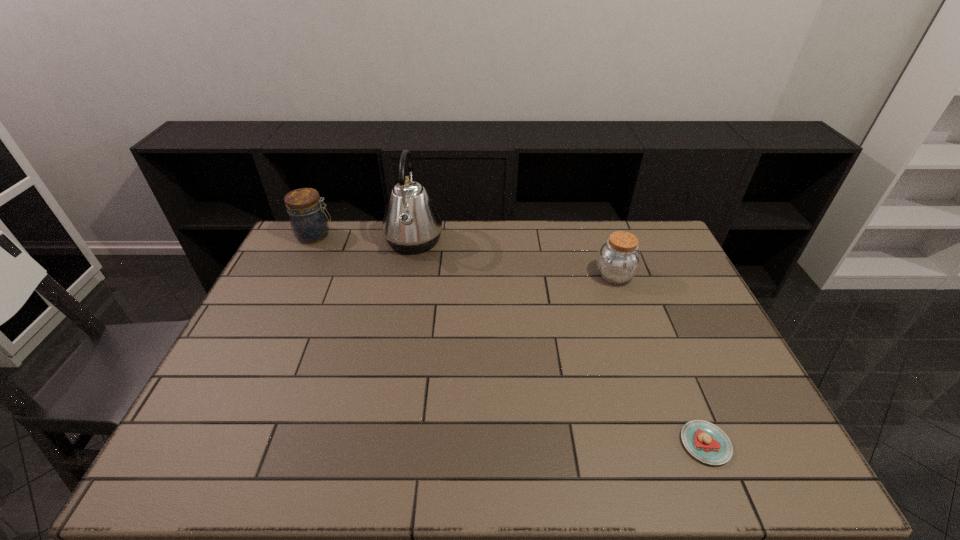
Locate an element on the screen. vacant point that satisfies the following two spatial constraints: 1. from the spout of the nearer jar; 2. on the right side of the second object from left to right is located at coordinates (407, 275).

The image size is (960, 540). Find the location of `free spot that satisfies the following two spatial constraints: 1. from the spout of the kettle; 2. on the right side of the right jar`. free spot that satisfies the following two spatial constraints: 1. from the spout of the kettle; 2. on the right side of the right jar is located at coordinates (407, 275).

You are a GUI agent. You are given a task and a screenshot of the screen. Output one action in this format:
    pyautogui.click(x=<x>, y=<y>)
    Task: Click on the vacant point that satisfies the following two spatial constraints: 1. from the spout of the third object from right to left; 2. on the back side of the right jar
    This screenshot has width=960, height=540.
    Given the screenshot: What is the action you would take?
    pyautogui.click(x=407, y=275)

Identify the location of free space that satisfies the following two spatial constraints: 1. on the back side of the shortest object; 2. from the spout of the second object from left to right. The width and height of the screenshot is (960, 540). (622, 241).

Where is `vacant space that satisfies the following two spatial constraints: 1. on the lid of the nearer jar; 2. on the right side of the left jar`? The image size is (960, 540). vacant space that satisfies the following two spatial constraints: 1. on the lid of the nearer jar; 2. on the right side of the left jar is located at coordinates (296, 275).

The image size is (960, 540). In order to click on blank space that satisfies the following two spatial constraints: 1. from the spout of the kettle; 2. on the right side of the nearest object in this screenshot , I will do `click(375, 443)`.